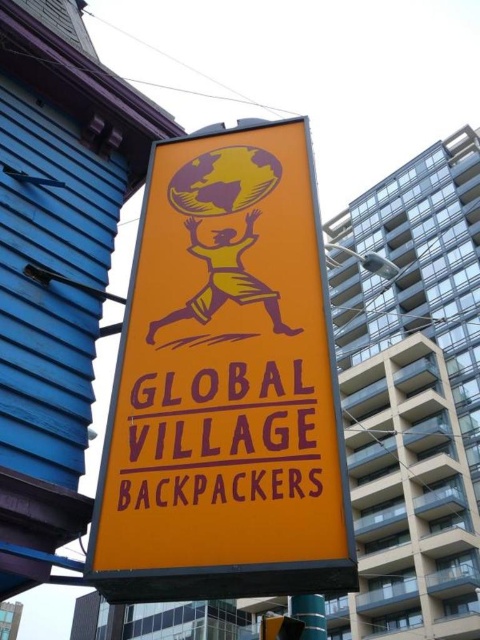
You are designing a poster and need to place the orange matte signboard at center and the purple matte sign at center. Given their sizes, which one should you place first to ensure proper visibility?

The orange matte signboard at center is larger in size than the purple matte sign at center, so you should place the orange matte signboard at center first to ensure it doesn not get obscured by the smaller purple matte sign at center.

You are a traveler trying to find the entrance to Global Village Backpackers. You see the orange matte signboard at center and the metallic blue pole at lower center. Which object is bigger and can help you locate the entrance?

The orange matte signboard at center has a larger size compared to the metallic blue pole at lower center, so the signboard is bigger and can help you locate the entrance.